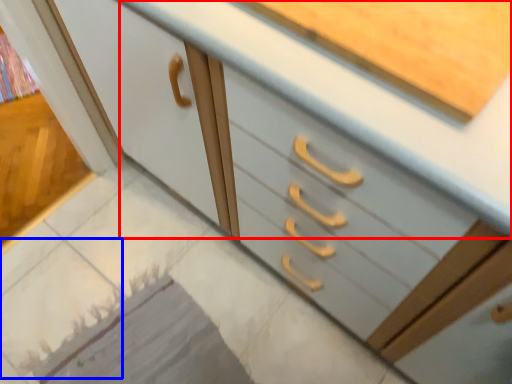
Question: Which object appears closest to the camera in this image, counter top (highlighted by a red box) or tile (highlighted by a blue box)?

Choices:
 (A) counter top
 (B) tile

Answer: (A)